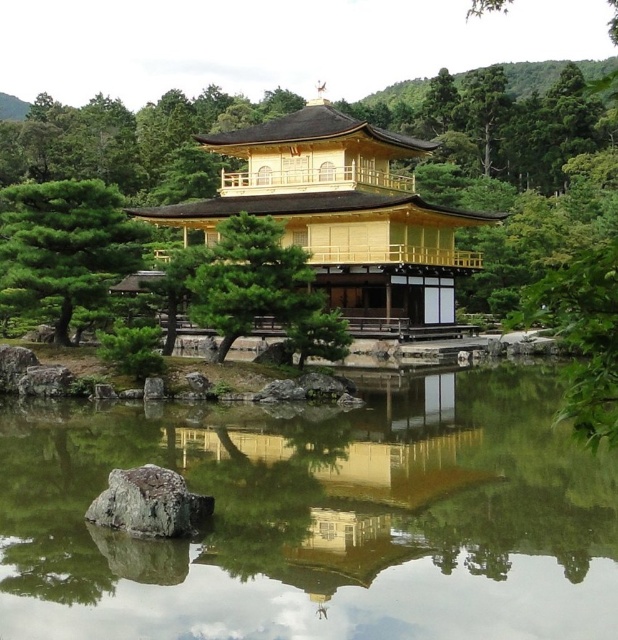
Question: Is transparent glass lake at center behind green matte tree at center-left?

Choices:
 (A) yes
 (B) no

Answer: (B)

Question: Which point is farther to the camera?

Choices:
 (A) golden polished wood pagoda at center
 (B) gray rough rock at center
 (C) transparent glass lake at center
 (D) green matte tree at center-left

Answer: (A)

Question: Can you confirm if transparent glass lake at center is positioned below golden polished wood pagoda at center?

Choices:
 (A) yes
 (B) no

Answer: (A)

Question: Can you confirm if golden polished wood pagoda at center is positioned below green textured tree at center?

Choices:
 (A) yes
 (B) no

Answer: (B)

Question: Based on their relative distances, which object is nearer to the transparent glass lake at center?

Choices:
 (A) green matte tree at center-left
 (B) green textured tree at center

Answer: (B)

Question: Which of the following is the farthest from the observer?

Choices:
 (A) golden polished wood pagoda at center
 (B) green matte tree at center-left

Answer: (A)